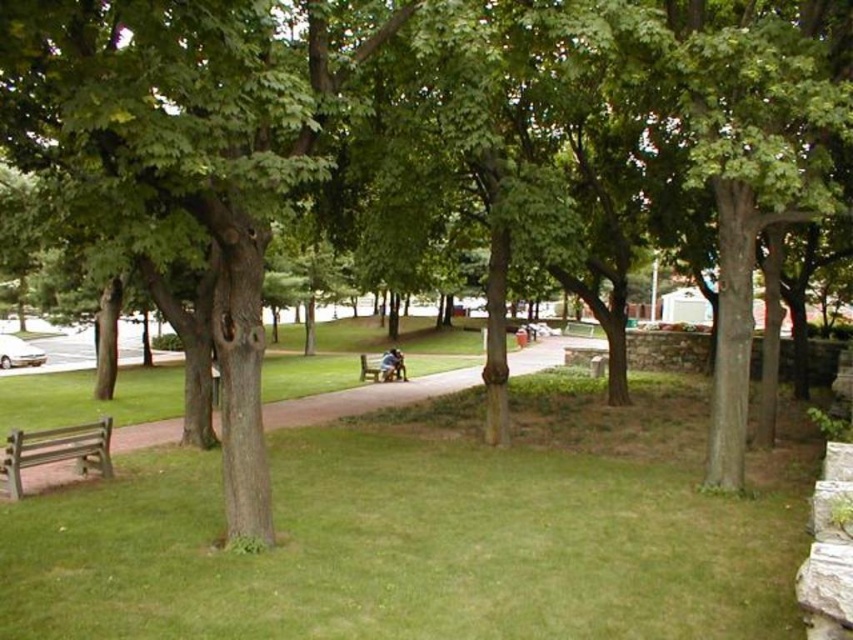
Question: Does wooden bench at lower left have a larger size compared to wooden park bench at center?

Choices:
 (A) no
 (B) yes

Answer: (B)

Question: Does wooden bench at lower left have a lesser width compared to wooden park bench at center?

Choices:
 (A) no
 (B) yes

Answer: (B)

Question: Which object appears closest to the camera in this image?

Choices:
 (A) wooden park bench at center
 (B) wooden bench at lower left

Answer: (B)

Question: Which point is closer to the camera?

Choices:
 (A) wooden park bench at center
 (B) wooden bench at lower left

Answer: (B)

Question: Is brown wooden bench at lower left closer to the viewer compared to wooden park bench at center?

Choices:
 (A) yes
 (B) no

Answer: (A)

Question: Which object is farther from the camera taking this photo?

Choices:
 (A) brown wooden bench at lower left
 (B) wooden bench at lower left
 (C) wooden park bench at center

Answer: (C)